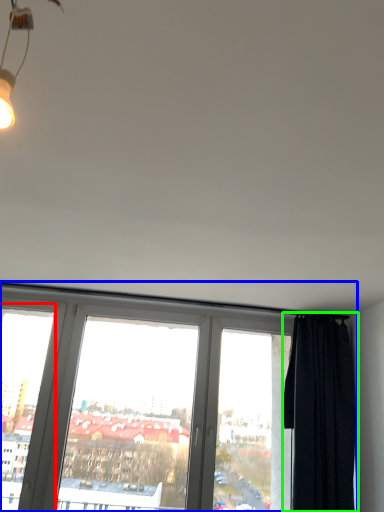
Question: Which object is positioned farthest from window frame (highlighted by a red box)? Select from window (highlighted by a blue box) and curtain (highlighted by a green box).

Choices:
 (A) window
 (B) curtain

Answer: (B)